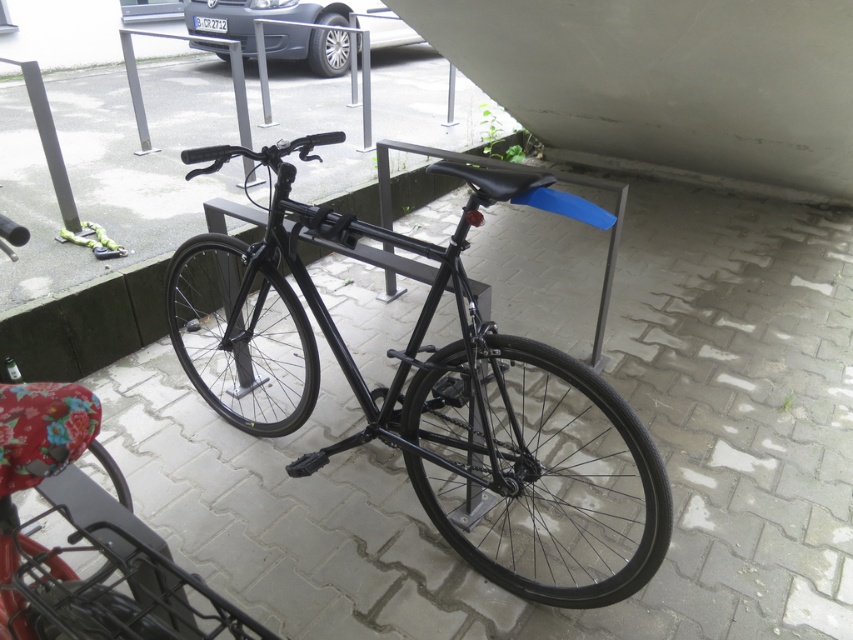
What do you see at coordinates (437, 397) in the screenshot?
I see `black matte bicycle at center` at bounding box center [437, 397].

Locate an element on the screen. This screenshot has width=853, height=640. black matte bicycle at center is located at coordinates (437, 397).